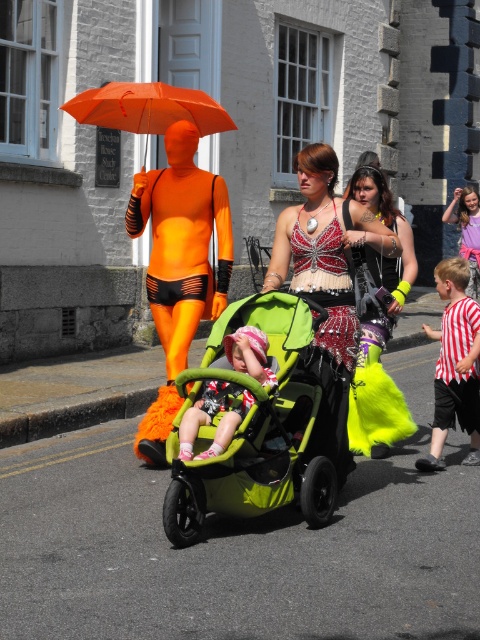
Between shiny metallic dress at center and neon yellow fur coat at center, which one appears on the left side from the viewer's perspective?

shiny metallic dress at center is more to the left.

Does shiny metallic dress at center have a smaller size compared to neon yellow fur coat at center?

Yes, shiny metallic dress at center is smaller than neon yellow fur coat at center.

Find the location of `shiny metallic dress at center`. shiny metallic dress at center is located at coordinates tap(328, 337).

This screenshot has width=480, height=640. Identify the location of shiny metallic dress at center. (328, 337).

Looking at this image, is neon yellow fur coat at center above striped fabric shirt at right?

Yes.

This screenshot has width=480, height=640. What do you see at coordinates (380, 326) in the screenshot? I see `neon yellow fur coat at center` at bounding box center [380, 326].

Where is `neon yellow fur coat at center`? This screenshot has width=480, height=640. neon yellow fur coat at center is located at coordinates (380, 326).

Can you confirm if neon yellow fur coat at center is shorter than orange matte umbrella at upper center?

Incorrect, neon yellow fur coat at center's height does not fall short of orange matte umbrella at upper center's.

Does point (386, 193) come behind point (130, 129)?

That is False.

Where is `neon yellow fur coat at center`? The width and height of the screenshot is (480, 640). neon yellow fur coat at center is located at coordinates (380, 326).